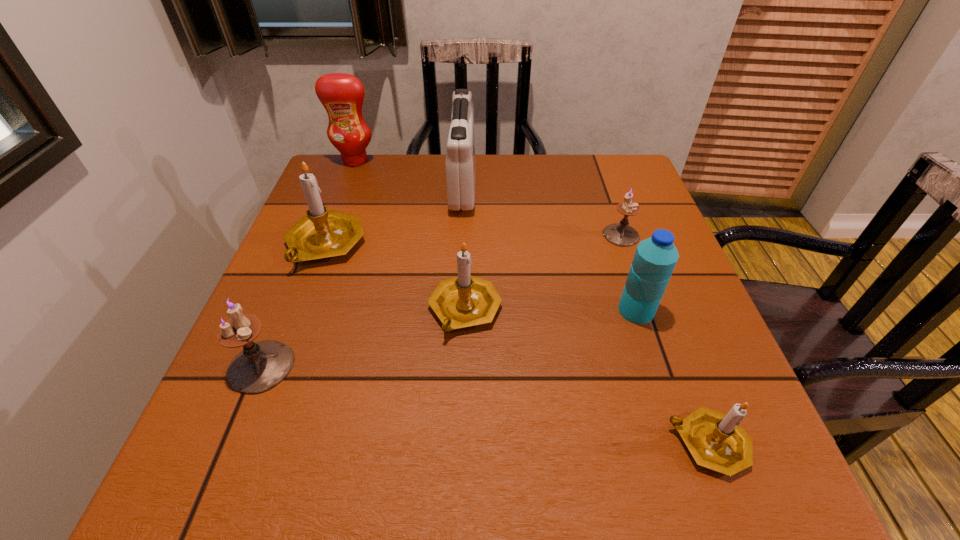
This screenshot has height=540, width=960. What are the coordinates of `vacant space located 0.080m on the left of the nearest object` in the screenshot? It's located at (617, 443).

This screenshot has width=960, height=540. What are the coordinates of `condiment present at the far edge` in the screenshot? It's located at (341, 94).

Locate an element on the screen. the first-aid kit positioned at the far edge is located at coordinates (460, 163).

This screenshot has height=540, width=960. What are the coordinates of `object that is at the near edge` in the screenshot? It's located at (716, 440).

Identify the location of condiment present at the left edge. This screenshot has width=960, height=540. (341, 94).

Image resolution: width=960 pixels, height=540 pixels. In order to click on water bottle located in the right edge section of the desktop in this screenshot , I will do `click(655, 258)`.

I want to click on object that is at the far left corner, so click(341, 94).

You are a GUI agent. You are given a task and a screenshot of the screen. Output one action in this format:
    pyautogui.click(x=<x>, y=<y>)
    Task: Click on the object that is at the near right corner
    Image resolution: width=960 pixels, height=540 pixels.
    Given the screenshot: What is the action you would take?
    pyautogui.click(x=716, y=440)

The image size is (960, 540). In the image, there is a desktop. Identify the location of free region at the far edge. (427, 201).

Where is `free region at the near edge`? The image size is (960, 540). free region at the near edge is located at coordinates (445, 463).